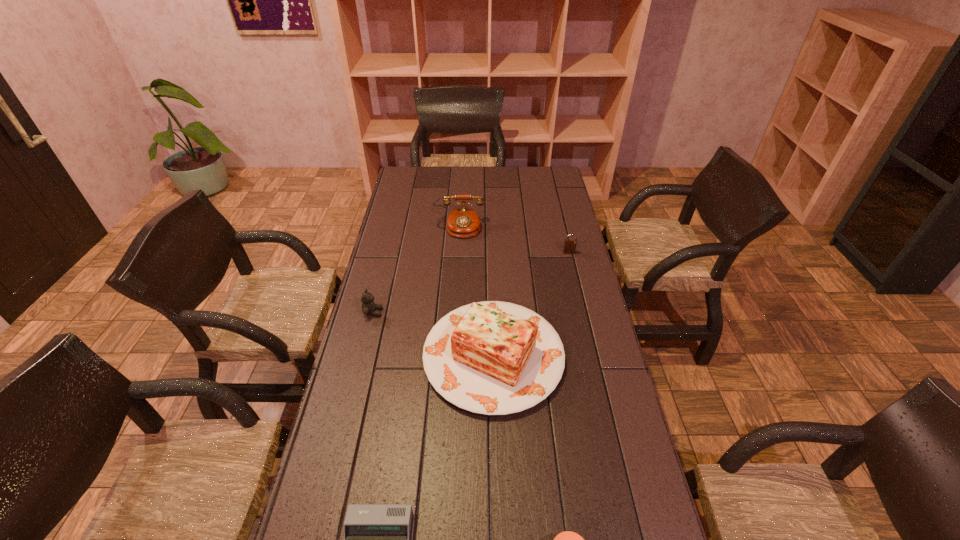
The image size is (960, 540). I want to click on lasagna present at the right edge, so coord(494,358).

Find the location of a particular element. This screenshot has height=540, width=960. padlock located at the right edge is located at coordinates (569, 246).

Where is `vacant region at the far edge of the desktop`? The image size is (960, 540). vacant region at the far edge of the desktop is located at coordinates (484, 177).

In the image, there is a desktop. Where is `vacant space at the left edge`? This screenshot has width=960, height=540. vacant space at the left edge is located at coordinates (410, 248).

Where is `vacant area at the right edge of the desktop`? Image resolution: width=960 pixels, height=540 pixels. vacant area at the right edge of the desktop is located at coordinates (557, 253).

Locate an element on the screen. The height and width of the screenshot is (540, 960). vacant space at the far left corner of the desktop is located at coordinates (403, 180).

This screenshot has height=540, width=960. Find the location of `free region at the far right corner`. free region at the far right corner is located at coordinates (561, 178).

Where is `vacant area between the second farthest object and the telephone`? This screenshot has width=960, height=540. vacant area between the second farthest object and the telephone is located at coordinates (514, 240).

This screenshot has width=960, height=540. In order to click on empty space that is in between the rightmost object and the teddy bear in this screenshot , I will do `click(471, 282)`.

Where is `vacant space that is in between the lasagna and the rightmost object`? vacant space that is in between the lasagna and the rightmost object is located at coordinates (531, 304).